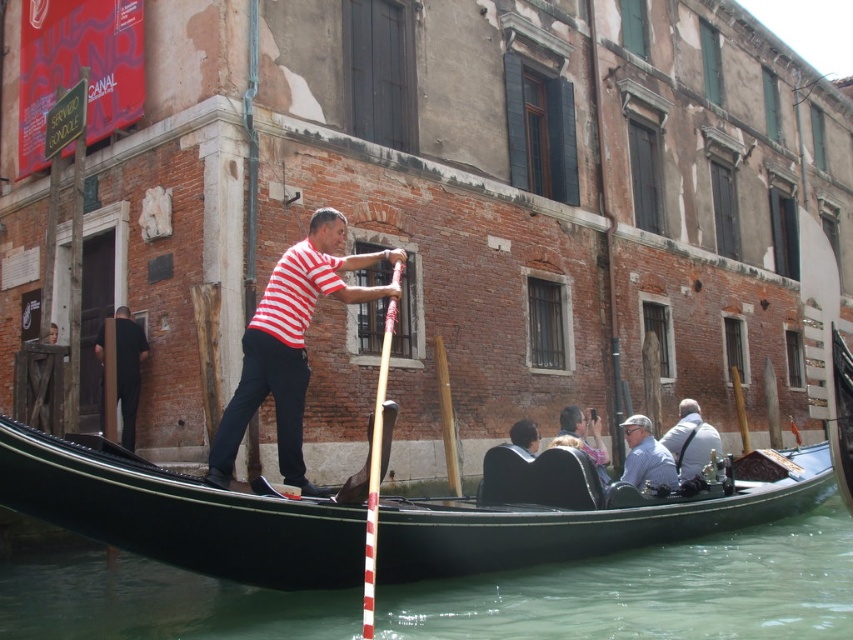
How much distance is there between light blue shirt at center and white leather jacket at center?

The distance of light blue shirt at center from white leather jacket at center is 2.67 meters.

Find the location of `light blue shirt at center`. light blue shirt at center is located at coordinates pyautogui.click(x=646, y=458).

Between point (90, 625) and point (276, 422), which one is positioned in front?

Point (90, 625) is in front.

This screenshot has width=853, height=640. What are the coordinates of `black glossy water at lower center` in the screenshot? It's located at (653, 592).

Measure the distance between black smooth suit at left and light blue shirt at center.

black smooth suit at left and light blue shirt at center are 91.91 feet apart from each other.

What do you see at coordinates (128, 371) in the screenshot? I see `black smooth suit at left` at bounding box center [128, 371].

Locate an element on the screen. The image size is (853, 640). black smooth suit at left is located at coordinates (128, 371).